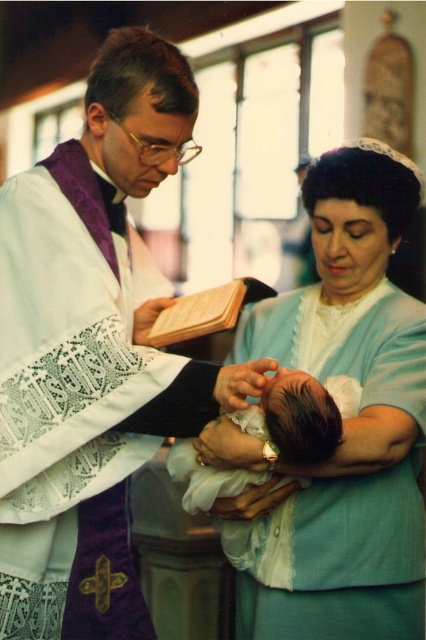
Question: Is purple lace fabric at center to the left of light blue fabric dress at center from the viewer's perspective?

Choices:
 (A) yes
 (B) no

Answer: (A)

Question: Which point is farther from the camera taking this photo?

Choices:
 (A) click(46, 275)
 (B) click(334, 417)

Answer: (A)

Question: Among these points, which one is farthest from the camera?

Choices:
 (A) 264,426
 (B) 77,433

Answer: (A)

Question: Does purple lace fabric at center appear on the left side of dark brown hair at center?

Choices:
 (A) no
 (B) yes

Answer: (B)

Question: Which is nearer to the purple lace fabric at center?

Choices:
 (A) dark brown hair at center
 (B) light blue fabric dress at center

Answer: (A)

Question: Does purple lace fabric at center appear on the left side of light blue fabric dress at center?

Choices:
 (A) no
 (B) yes

Answer: (B)